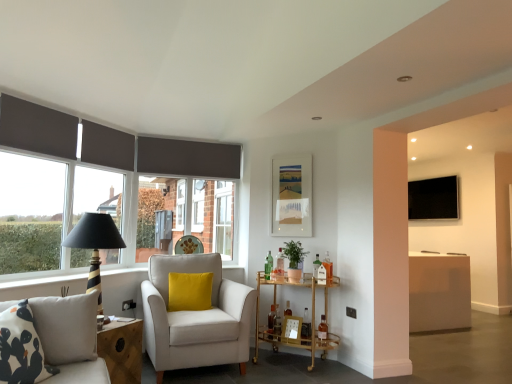
Find the location of `blank space situated above matte black lampshade at left (from a real-world perspective)`. blank space situated above matte black lampshade at left (from a real-world perspective) is located at coordinates (115, 127).